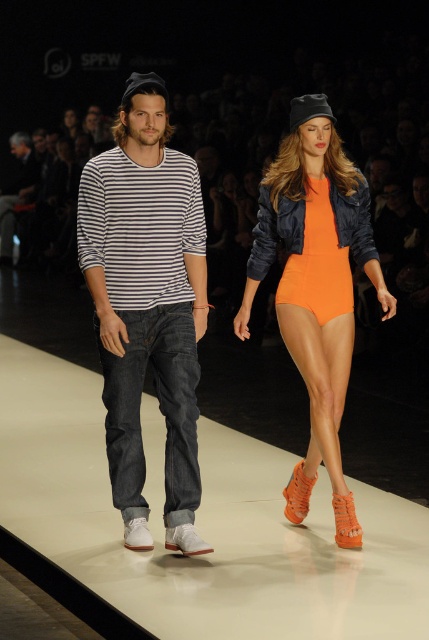
In the scene shown: You are a photographer at the runway show and need to capture both the striped cotton shirt at center and the orange matte bodysuit at center in a single frame. Since the camera has a limited focus range, which item should you prioritize to ensure it is in focus if you can only focus on one?

The striped cotton shirt at center is smaller than the orange matte bodysuit at center, so you should prioritize focusing on the orange matte bodysuit at center because larger objects require more precise focus to capture details effectively.

You are standing at the runway entrance and want to take a photo of the point at coordinates point (135, 275). If your camera has a maximum focus range of 15 feet, will you be able to focus on the point?

The point (135, 275) is 15.70 feet away from the viewer, which exceeds the camera maximum focus range of 15 feet. Therefore, the camera cannot focus on the point.

You are a fashion designer observing the runway show. You notice the striped cotton shirt at center and denim jeans at center. Which clothing item appears to be smaller in size?

The striped cotton shirt at center is smaller in size compared to the denim jeans at center.